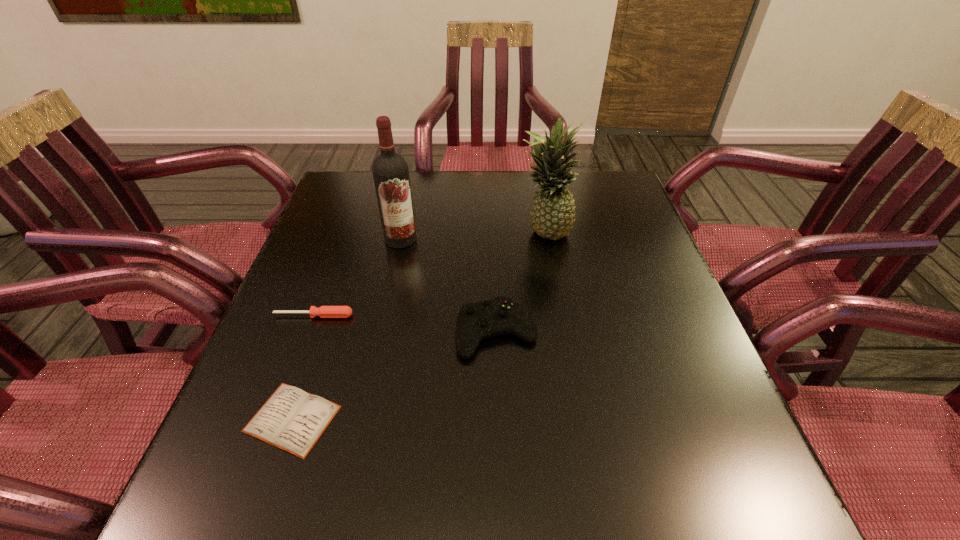
Find the location of a particular element. empty space between the pineapple and the third object from left to right is located at coordinates (472, 237).

This screenshot has height=540, width=960. Find the location of `free point between the pineapple and the third object from left to right`. free point between the pineapple and the third object from left to right is located at coordinates (472, 237).

The height and width of the screenshot is (540, 960). Find the location of `empty location between the wine bottle and the third tallest object`. empty location between the wine bottle and the third tallest object is located at coordinates (448, 286).

Locate an element on the screen. free area in between the screwdriver and the wine bottle is located at coordinates (357, 277).

Locate an element on the screen. vacant space that's between the diary and the second shortest object is located at coordinates (303, 367).

Find the location of `vacant space that is in between the third shortest object and the pineapple`. vacant space that is in between the third shortest object and the pineapple is located at coordinates (520, 283).

Locate an element on the screen. This screenshot has height=540, width=960. vacant space that is in between the fourth tallest object and the third shortest object is located at coordinates (405, 324).

At what (x,y) coordinates should I click in order to perform the action: click on free area in between the control and the wine bottle. Please return your answer as a coordinate pair (x, y). The image size is (960, 540). Looking at the image, I should click on tap(448, 286).

The image size is (960, 540). I want to click on vacant region between the control and the second shortest object, so click(405, 324).

I want to click on vacant area that lies between the nearest object and the fourth tallest object, so click(303, 367).